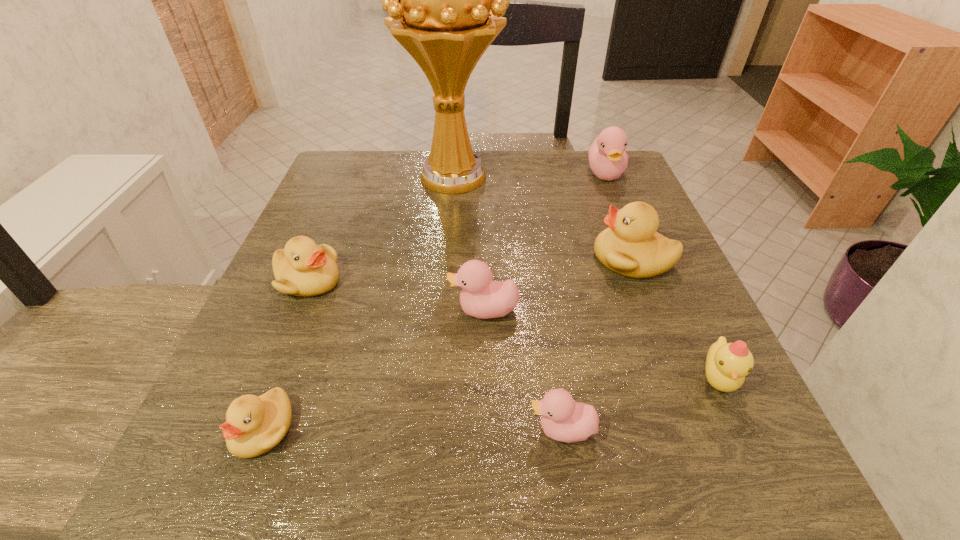
The image size is (960, 540). Find the location of `duckling that is at the far edge`. duckling that is at the far edge is located at coordinates (608, 159).

Find the location of a particular element. object at the near left corner is located at coordinates (254, 425).

Locate an element on the screen. The width and height of the screenshot is (960, 540). object located at the far right corner is located at coordinates (608, 159).

Find the location of a particular element. This screenshot has width=960, height=540. vacant space at the far edge of the desktop is located at coordinates (499, 197).

Image resolution: width=960 pixels, height=540 pixels. In the image, there is a desktop. In order to click on vacant space at the near edge in this screenshot , I will do (373, 504).

Where is `vacant space at the left edge of the desktop`? vacant space at the left edge of the desktop is located at coordinates click(x=273, y=329).

At what (x,y) coordinates should I click in order to perform the action: click on vacant space at the right edge. Please return your answer as a coordinate pair (x, y). The image size is (960, 540). Looking at the image, I should click on (625, 206).

This screenshot has width=960, height=540. What are the coordinates of `vacant space at the far left corner of the desktop` in the screenshot? It's located at (394, 158).

Where is `blank space at the near left corner of the desktop`? The height and width of the screenshot is (540, 960). blank space at the near left corner of the desktop is located at coordinates (303, 485).

At what (x,y) coordinates should I click in order to perform the action: click on vacant space at the near right corner. Please return your answer as a coordinate pair (x, y). Looking at the image, I should click on (700, 484).